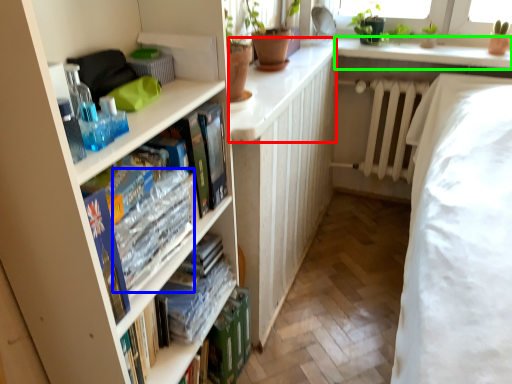
Question: Which is nearer to the counter top (highlighted by a red box)? book (highlighted by a blue box) or window sill (highlighted by a green box).

Choices:
 (A) book
 (B) window sill

Answer: (A)